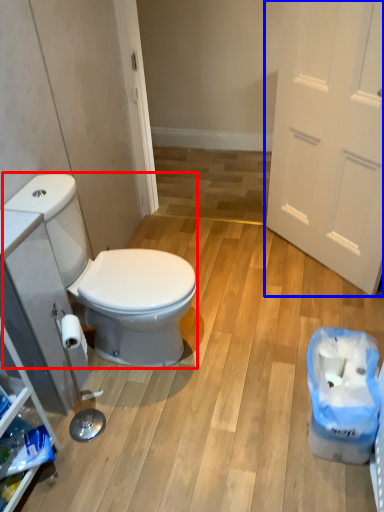
Question: Which of the following is the farthest to the observer, sit (highlighted by a red box) or door (highlighted by a blue box)?

Choices:
 (A) sit
 (B) door

Answer: (B)